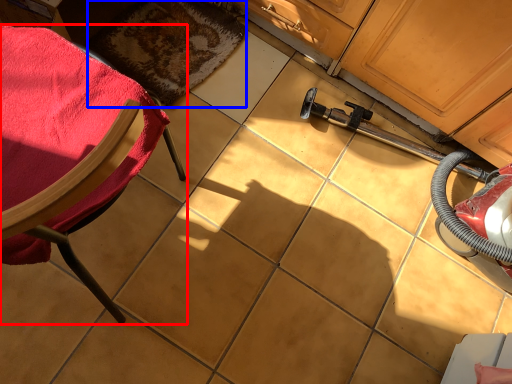
Question: Which object appears closest to the camera in this image, chair (highlighted by a red box) or mat (highlighted by a blue box)?

Choices:
 (A) chair
 (B) mat

Answer: (A)